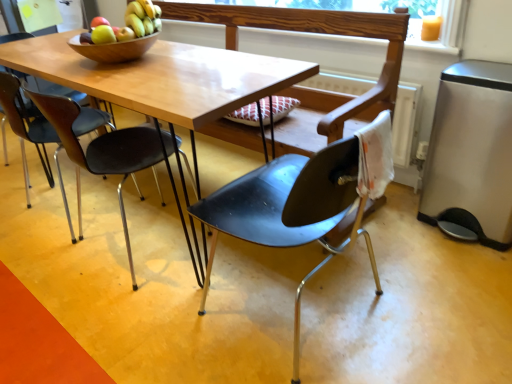
This screenshot has width=512, height=384. I want to click on free location in front of black plastic chair at left, which appears as the second chair when viewed from the right, so pos(116,307).